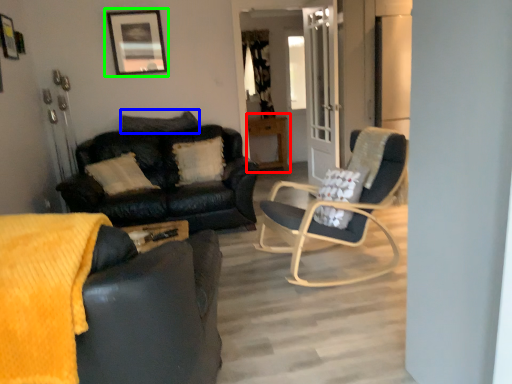
Question: Which object is positioned farthest from table (highlighted by a red box)? Select from pillow (highlighted by a blue box) and picture frame (highlighted by a green box).

Choices:
 (A) pillow
 (B) picture frame

Answer: (B)